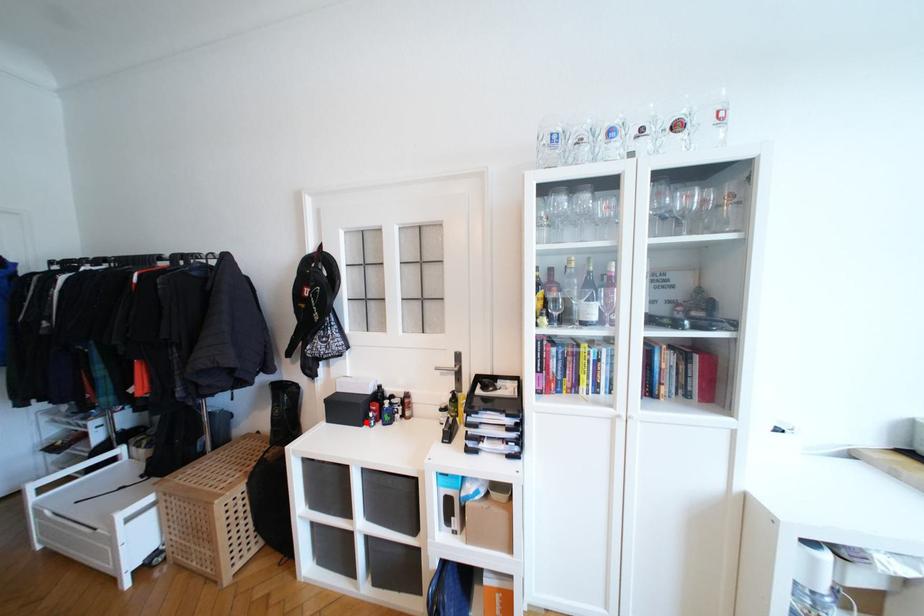
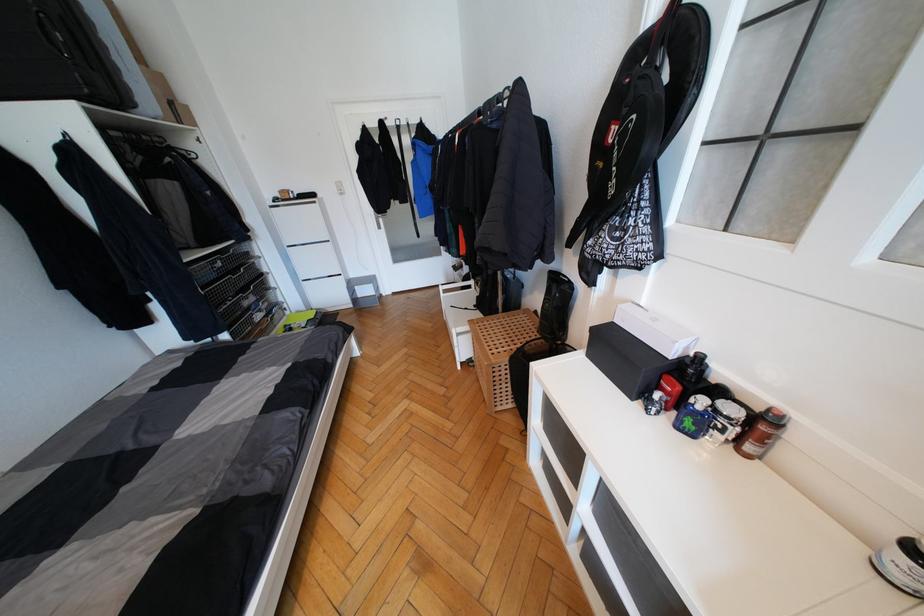
The point at the highlighted location is marked in the first image. Where is the corresponding point in the second image?

(640, 392)